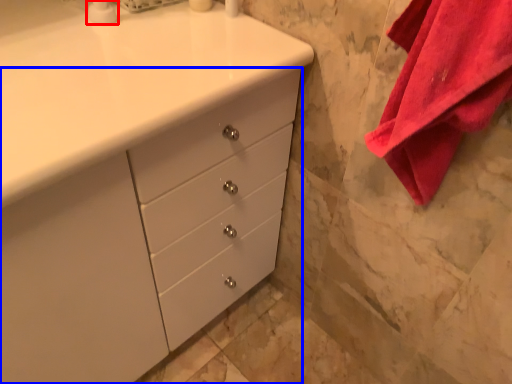
Question: Among these objects, which one is farthest to the camera, soap dispenser (highlighted by a red box) or chest of drawers (highlighted by a blue box)?

Choices:
 (A) soap dispenser
 (B) chest of drawers

Answer: (A)